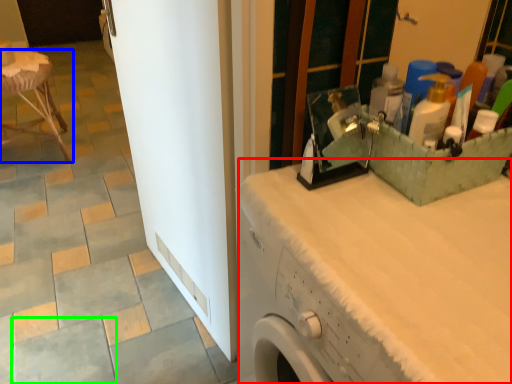
Question: Based on their relative distances, which object is nearer to counter top (highlighted by a red box)? Choose from furniture (highlighted by a blue box) and ceramic tile (highlighted by a green box).

Choices:
 (A) furniture
 (B) ceramic tile

Answer: (B)